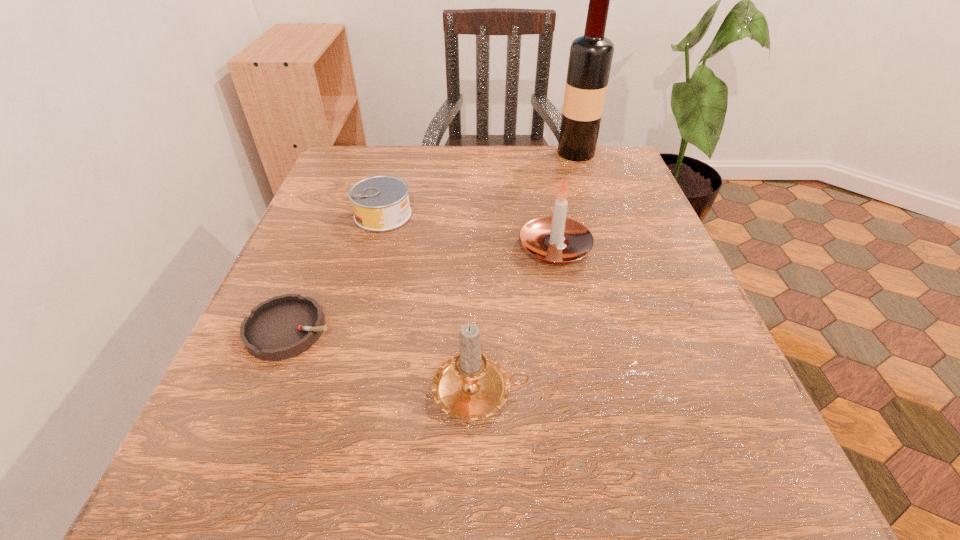
What are the coordinates of `free space that is in between the nearer candle and the farther candle` in the screenshot? It's located at (517, 320).

Image resolution: width=960 pixels, height=540 pixels. Identify the location of vacant space that's between the can and the shortest object. (337, 273).

Identify the location of vacant point located between the farther candle and the can. This screenshot has width=960, height=540. (468, 232).

Identify the location of empty space that is in between the second shortest object and the tallest object. (480, 184).

Select which object is the third closest to the can. Please provide its 2D coordinates. Your answer should be formatted as a tuple, i.e. [(x, y)], where the tuple contains the x and y coordinates of a point satisfying the conditions above.

[(470, 386)]

Where is `object that stands as the fourth closest to the left candle`? The height and width of the screenshot is (540, 960). object that stands as the fourth closest to the left candle is located at coordinates (590, 59).

The height and width of the screenshot is (540, 960). I want to click on free location that satisfies the following two spatial constraints: 1. on the back side of the right candle; 2. on the left side of the tallest object, so click(536, 152).

The height and width of the screenshot is (540, 960). Identify the location of vacant space that satisfies the following two spatial constraints: 1. on the front side of the second shortest object; 2. on the right side of the farther candle. (373, 248).

This screenshot has height=540, width=960. Find the location of `vacant space that satisfies the following two spatial constraints: 1. on the back side of the right candle; 2. on the right side of the farthest object`. vacant space that satisfies the following two spatial constraints: 1. on the back side of the right candle; 2. on the right side of the farthest object is located at coordinates (536, 152).